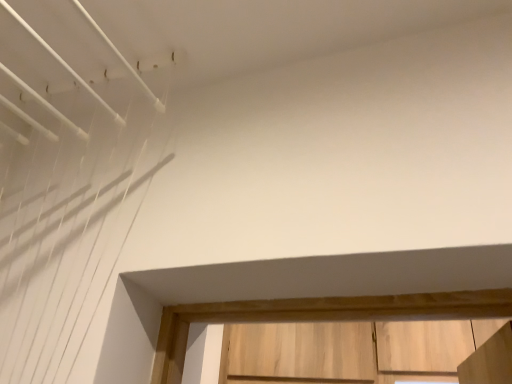
Where is `light wood cabinet at lower center`? This screenshot has height=384, width=512. light wood cabinet at lower center is located at coordinates (300, 353).

What do you see at coordinates (300, 353) in the screenshot? Image resolution: width=512 pixels, height=384 pixels. I see `light wood cabinet at lower center` at bounding box center [300, 353].

Locate an element on the screen. This screenshot has width=512, height=384. light wood cabinet at lower center is located at coordinates (300, 353).